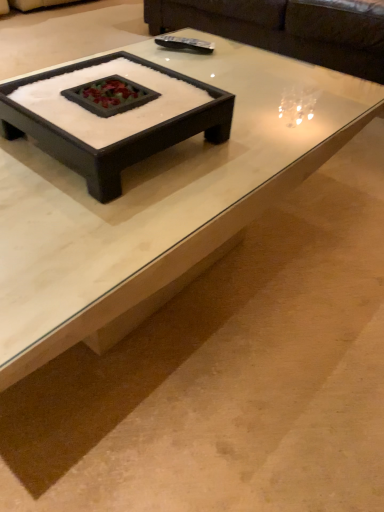
You are a GUI agent. You are given a task and a screenshot of the screen. Output one action in this format:
    pyautogui.click(x=<x>, y=<y>)
    Task: Click on the vacant space situated above white glossy coffee table at center, which appears as the first coffee table when viewed from the front (from a real-world perspective)
    The height and width of the screenshot is (512, 384).
    Given the screenshot: What is the action you would take?
    pyautogui.click(x=167, y=152)